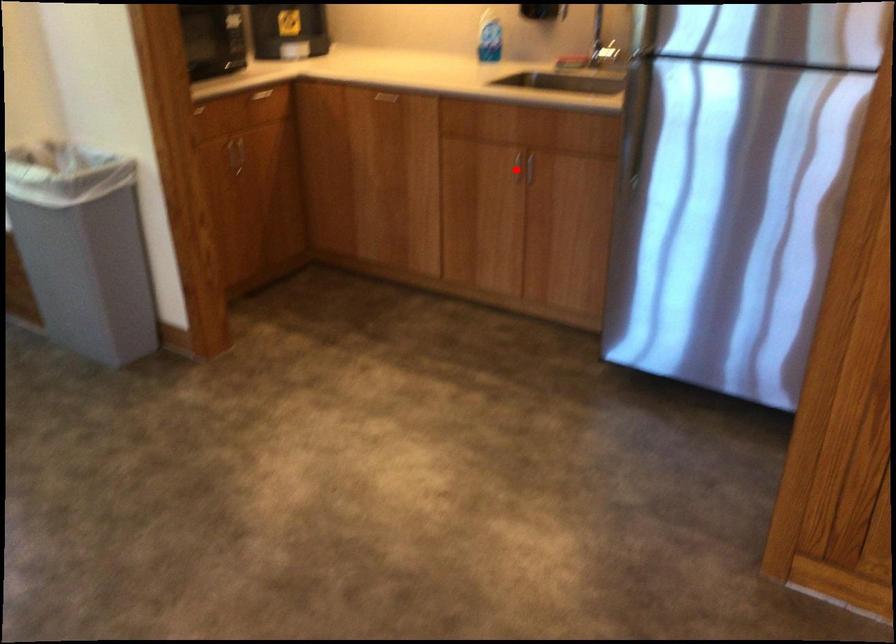
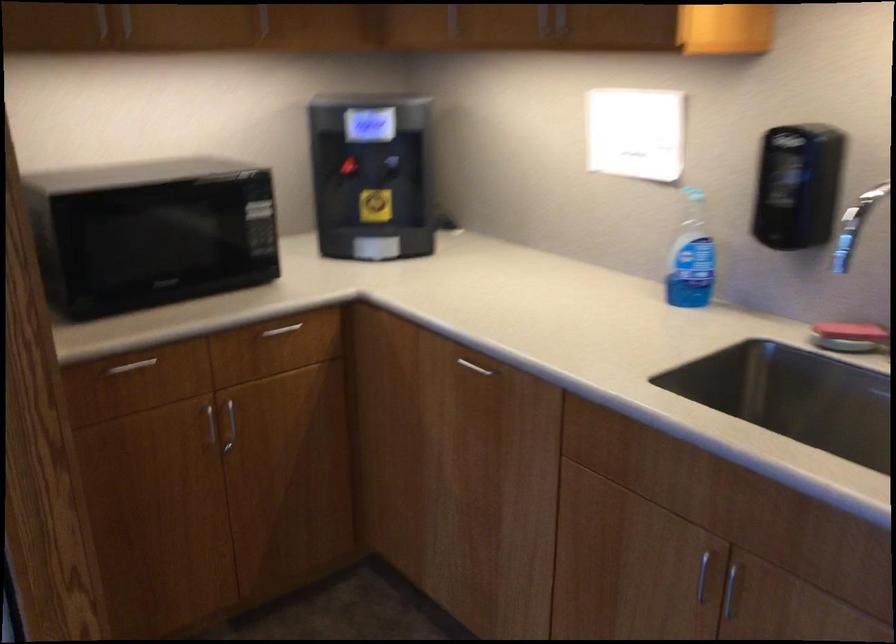
Question: A red point is marked in image1. In image2, is the corresponding 3D point closer to the camera or farther? Reply with the corresponding letter.

Choices:
 (A) The corresponding 3D point is closer.
 (B) The corresponding 3D point is farther.

Answer: (A)